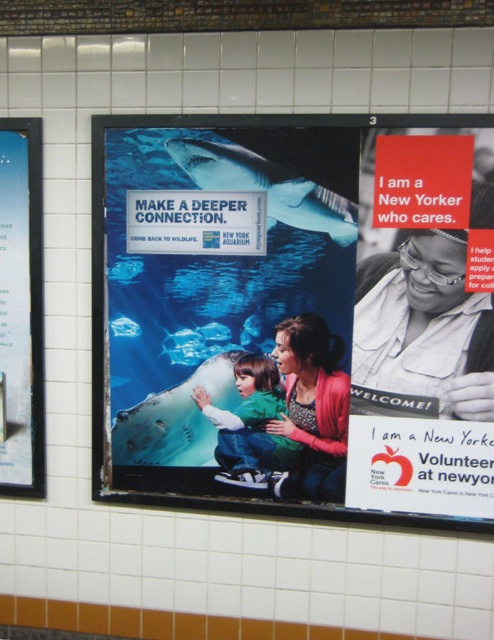
You are standing in the subway station and see both the white shirt at upper right and the green cotton shirt at center. Which shirt is positioned more to the right side of the wall?

The white shirt at upper right is positioned more to the right side of the wall because it is to the right of the green cotton shirt at center.

You are standing in the subway station and see both the matte blue poster at center and the green cotton shirt at center. Which one is positioned to the right of the other?

The matte blue poster at center is to the right of the green cotton shirt at center.

You are standing in the subway station and want to find the matte blue poster at center. According to the scene description, where should you look?

The matte blue poster at center is located at point (293, 314), so you should look there.